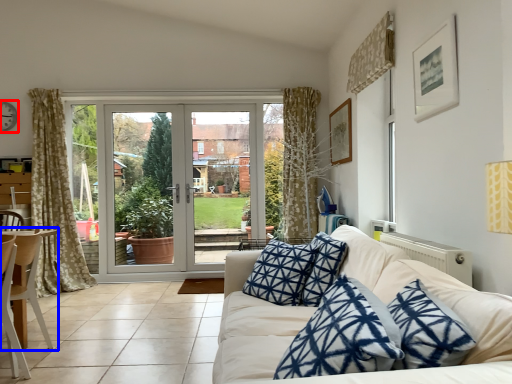
Question: Which object is closer to the camera taking this photo, clock (highlighted by a red box) or chair (highlighted by a blue box)?

Choices:
 (A) clock
 (B) chair

Answer: (B)